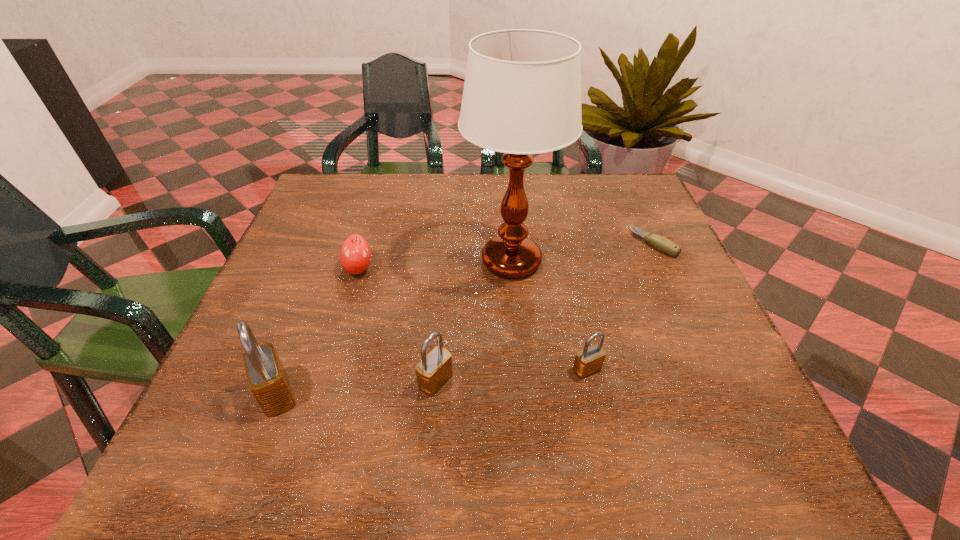
Identify the location of vacant space located on the left of the fourth object from right to left. (250, 381).

Identify the location of blank space located on the back of the shortest padlock. (563, 252).

Where is `vacant space situated 0.050m on the back of the second object from left to right`? The image size is (960, 540). vacant space situated 0.050m on the back of the second object from left to right is located at coordinates (367, 242).

Where is `vacant region located on the front of the shortest object`? Image resolution: width=960 pixels, height=540 pixels. vacant region located on the front of the shortest object is located at coordinates (668, 273).

This screenshot has width=960, height=540. What are the coordinates of `free space located on the front of the tallest object` in the screenshot? It's located at (516, 321).

Find the location of `padlock at the left edge`. padlock at the left edge is located at coordinates (267, 379).

You are a GUI agent. You are given a task and a screenshot of the screen. Output one action in this format:
    pyautogui.click(x=<x>, y=<y>)
    Task: Click on the apple positioned at the left edge
    The width and height of the screenshot is (960, 540).
    Given the screenshot: What is the action you would take?
    pyautogui.click(x=355, y=255)

Locate an element on the screen. The width and height of the screenshot is (960, 540). object that is at the right edge is located at coordinates (662, 244).

You are a GUI agent. You are given a task and a screenshot of the screen. Output one action in this format:
    pyautogui.click(x=<x>, y=<y>)
    Task: Click on the object that is at the near left corner
    This screenshot has height=540, width=960.
    Given the screenshot: What is the action you would take?
    pyautogui.click(x=267, y=379)

Identify the location of vacant space at the far edge. This screenshot has width=960, height=540. (372, 198).